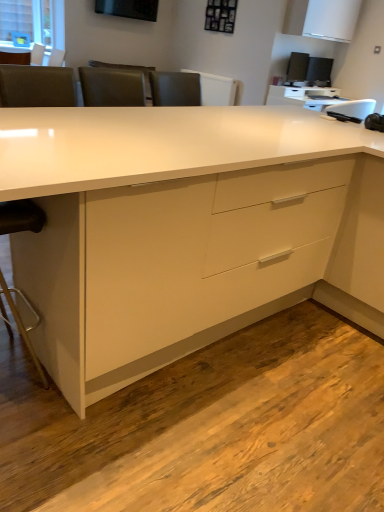
Question: Is white glossy cabinet at upper right next to black plastic desktop computer at upper right?

Choices:
 (A) no
 (B) yes

Answer: (A)

Question: Is white glossy cabinet at upper right thinner than black plastic desktop computer at upper right?

Choices:
 (A) yes
 (B) no

Answer: (B)

Question: Can you confirm if white glossy cabinet at upper right is bigger than black plastic desktop computer at upper right?

Choices:
 (A) yes
 (B) no

Answer: (A)

Question: Is white glossy cabinet at upper right aimed at black plastic desktop computer at upper right?

Choices:
 (A) yes
 (B) no

Answer: (B)

Question: From a real-world perspective, is white glossy cabinet at upper right positioned under black plastic desktop computer at upper right based on gravity?

Choices:
 (A) yes
 (B) no

Answer: (B)

Question: Is white glossy desk at center in front of or behind black leather swivel chair at left in the image?

Choices:
 (A) behind
 (B) front

Answer: (B)

Question: Is white glossy desk at center bigger or smaller than black leather swivel chair at left?

Choices:
 (A) big
 (B) small

Answer: (A)

Question: Would you say white glossy desk at center is inside or outside black leather swivel chair at left?

Choices:
 (A) inside
 (B) outside

Answer: (B)

Question: Looking at their shapes, would you say white glossy desk at center is wider or thinner than black leather swivel chair at left?

Choices:
 (A) wide
 (B) thin

Answer: (A)

Question: From the image's perspective, is white glossy computer desk at upper right above or below black plastic desktop computer at upper right?

Choices:
 (A) above
 (B) below

Answer: (B)

Question: In terms of height, does white glossy computer desk at upper right look taller or shorter compared to black plastic desktop computer at upper right?

Choices:
 (A) tall
 (B) short

Answer: (B)

Question: Considering the positions of point (321, 96) and point (289, 82), is point (321, 96) closer or farther from the camera than point (289, 82)?

Choices:
 (A) closer
 (B) farther

Answer: (A)

Question: Would you say white glossy computer desk at upper right is to the left or to the right of black plastic desktop computer at upper right in the picture?

Choices:
 (A) left
 (B) right

Answer: (A)

Question: Is white glossy cabinet at upper right situated inside black plastic desktop computer at upper right or outside?

Choices:
 (A) outside
 (B) inside

Answer: (A)

Question: Considering the relative positions of white glossy cabinet at upper right and black plastic desktop computer at upper right in the image provided, is white glossy cabinet at upper right to the left or to the right of black plastic desktop computer at upper right?

Choices:
 (A) left
 (B) right

Answer: (A)